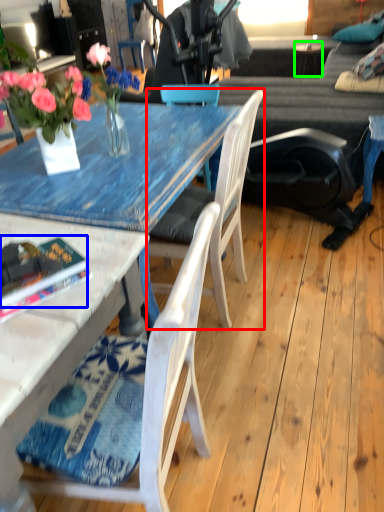
Question: Which object is positioned farthest from chair (highlighted by a red box)? Select from book (highlighted by a blue box) and side table (highlighted by a green box).

Choices:
 (A) book
 (B) side table

Answer: (B)